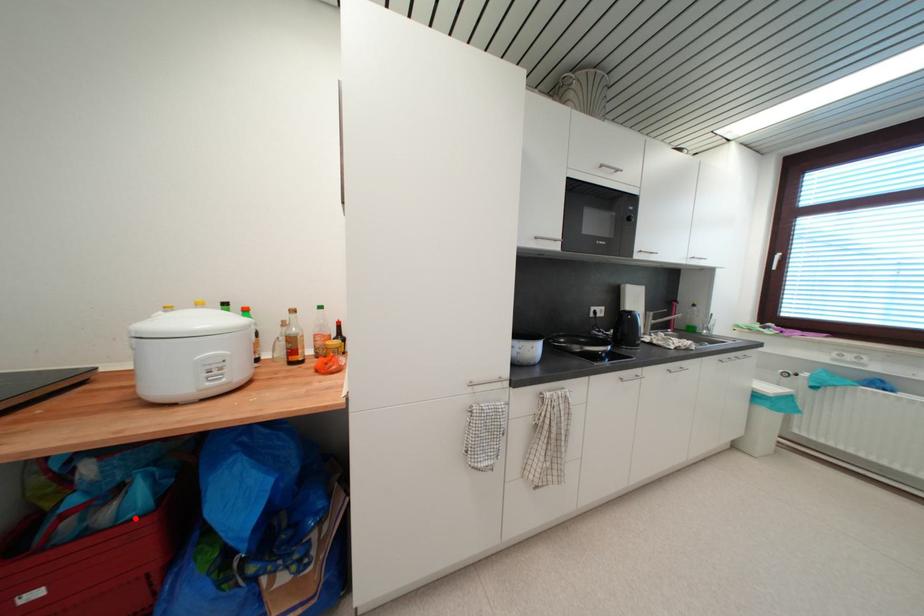
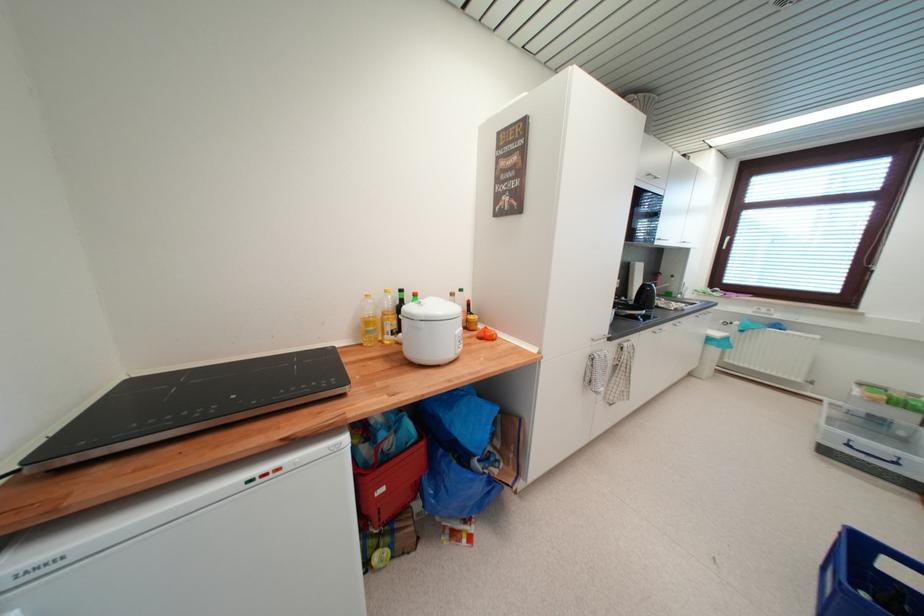
Question: I am providing you with two images of the same scene from different viewpoints. A red point is marked on the first image. At the location where the point appears in image 1, is it still visible in image 2?

Choices:
 (A) Yes
 (B) No

Answer: (A)